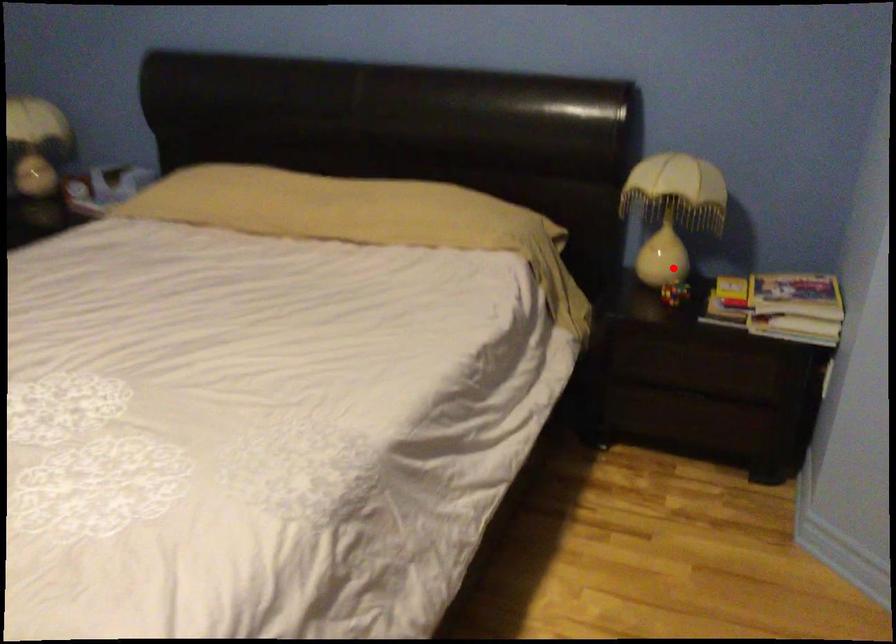
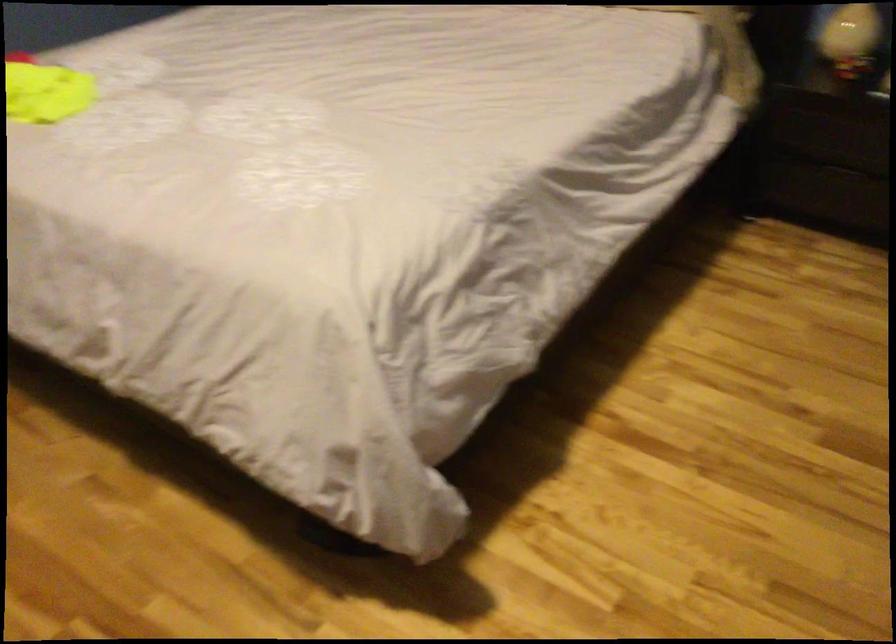
Question: I am providing you with two images of the same scene from different viewpoints. A red point is marked on the first image. Can you still see the location of the red point in image 2?

Choices:
 (A) Yes
 (B) No

Answer: (A)